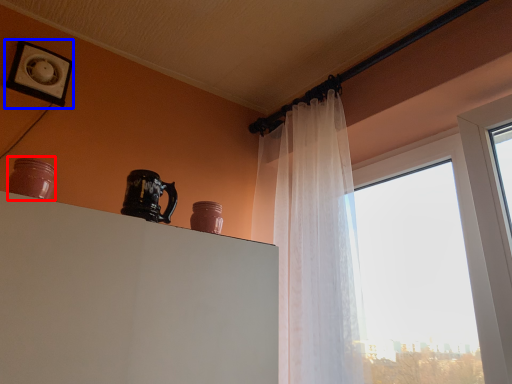
Question: Which point is further to the camera, pottery (highlighted by a red box) or picture frame (highlighted by a blue box)?

Choices:
 (A) pottery
 (B) picture frame

Answer: (B)